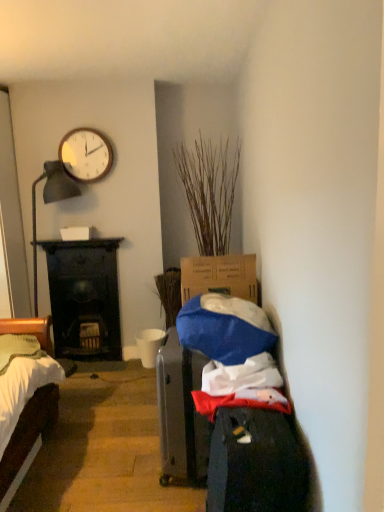
Question: Could you tell me if white matte cup at center is facing wooden clock at upper left?

Choices:
 (A) yes
 (B) no

Answer: (B)

Question: From the image's perspective, is white matte cup at center on wooden clock at upper left?

Choices:
 (A) yes
 (B) no

Answer: (B)

Question: Does white matte cup at center have a greater height compared to wooden clock at upper left?

Choices:
 (A) yes
 (B) no

Answer: (B)

Question: From a real-world perspective, is white matte cup at center physically below wooden clock at upper left?

Choices:
 (A) no
 (B) yes

Answer: (B)

Question: Is white matte cup at center thinner than wooden clock at upper left?

Choices:
 (A) no
 (B) yes

Answer: (A)

Question: Is wooden clock at upper left a part of white matte cup at center?

Choices:
 (A) no
 (B) yes

Answer: (A)

Question: Does white matte cup at center have a smaller size compared to dry wood plant at center?

Choices:
 (A) no
 (B) yes

Answer: (B)

Question: Does white matte cup at center appear on the left side of dry wood plant at center?

Choices:
 (A) yes
 (B) no

Answer: (A)

Question: Is white matte cup at center outside dry wood plant at center?

Choices:
 (A) yes
 (B) no

Answer: (A)

Question: Would you say white matte cup at center contains dry wood plant at center?

Choices:
 (A) yes
 (B) no

Answer: (B)

Question: Considering the relative sizes of white matte cup at center and dry wood plant at center in the image provided, is white matte cup at center thinner than dry wood plant at center?

Choices:
 (A) no
 (B) yes

Answer: (B)

Question: From a real-world perspective, is white matte cup at center physically below dry wood plant at center?

Choices:
 (A) no
 (B) yes

Answer: (B)

Question: Does dark wood fireplace at left lie behind dry wood plant at center?

Choices:
 (A) yes
 (B) no

Answer: (A)